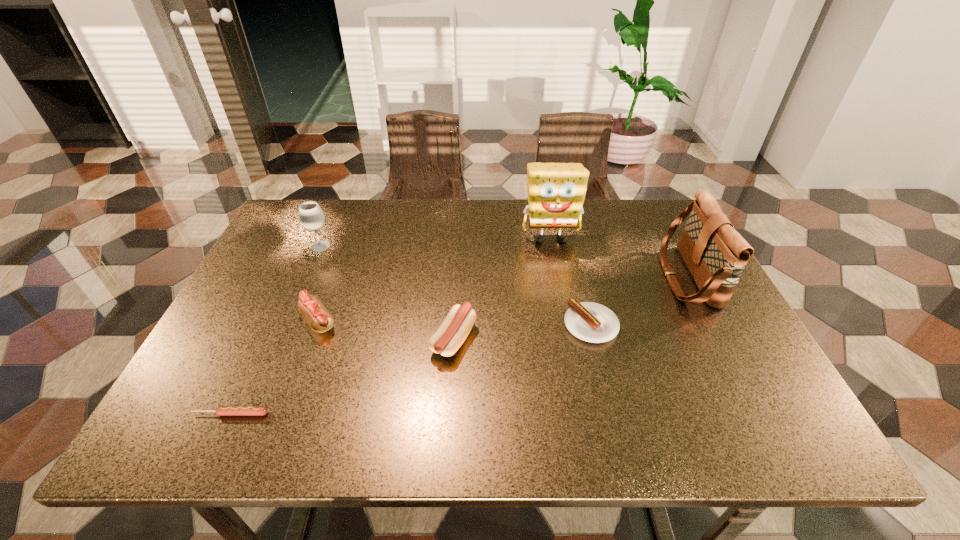
Where is `object at the near edge`? object at the near edge is located at coordinates (221, 410).

The image size is (960, 540). In order to click on wineglass located in the left edge section of the desktop in this screenshot , I will do click(311, 216).

What are the coordinates of `sausage located at the left edge` in the screenshot? It's located at (221, 410).

The width and height of the screenshot is (960, 540). I want to click on object present at the right edge, so click(715, 253).

Identify the location of object present at the far left corner. This screenshot has height=540, width=960. (311, 216).

At what (x,y) coordinates should I click in order to perform the action: click on object that is positioned at the near left corner. Please return your answer as a coordinate pair (x, y). The width and height of the screenshot is (960, 540). Looking at the image, I should click on (221, 410).

Locate an element on the screen. object located at the far right corner is located at coordinates (715, 253).

The height and width of the screenshot is (540, 960). What are the coordinates of `free location at the far edge` in the screenshot? It's located at pos(564,234).

Locate an element on the screen. This screenshot has width=960, height=540. free space at the near edge of the desktop is located at coordinates (709, 435).

This screenshot has height=540, width=960. I want to click on blank area at the left edge, so click(292, 305).